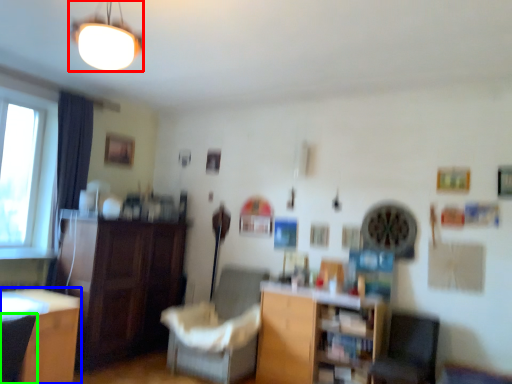
Question: Estimate the real-world distances between objects in this image. Which object is closer to lamp (highlighted by a red box), desk (highlighted by a blue box) or armchair (highlighted by a green box)?

Choices:
 (A) desk
 (B) armchair

Answer: (B)